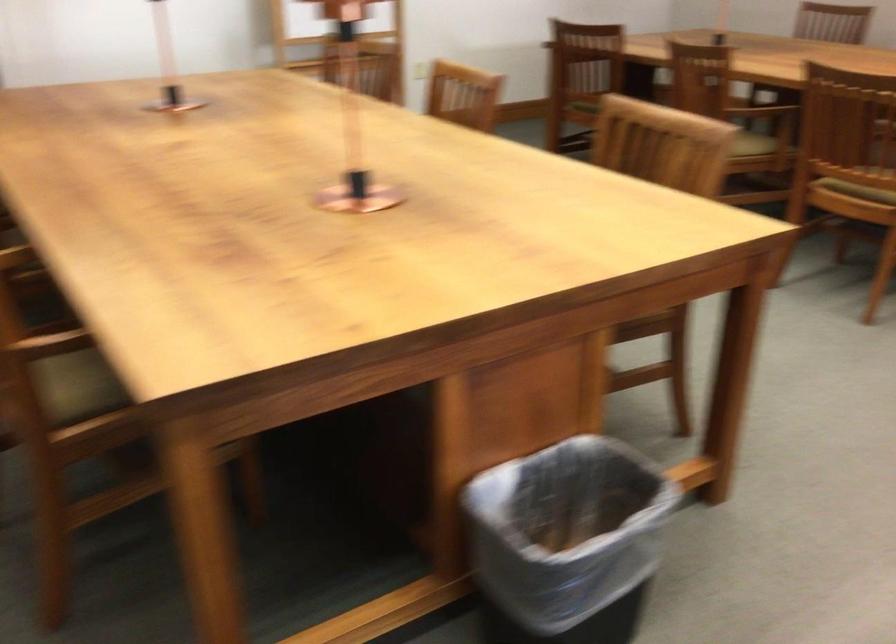
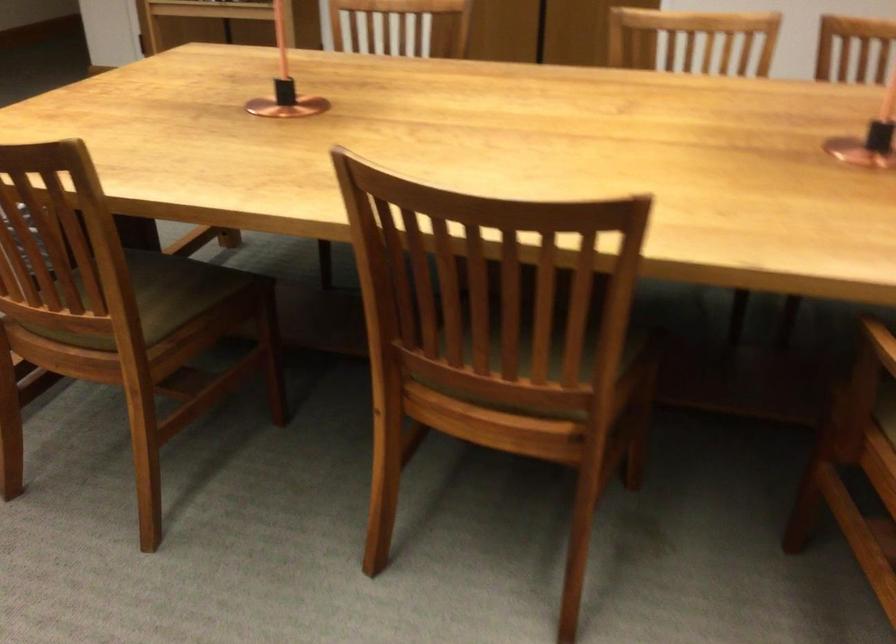
Question: I am providing you with two images of the same scene from different viewpoints. Please identify which objects are invisible in image2.

Choices:
 (A) copper table object
 (B) green chair sitting surface
 (C) recessed dishwasher handle
 (D) wooden chair sitting surface

Answer: (D)